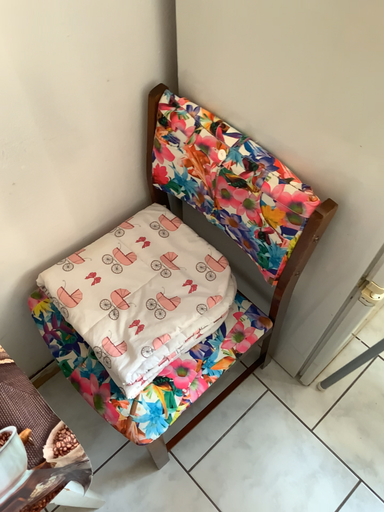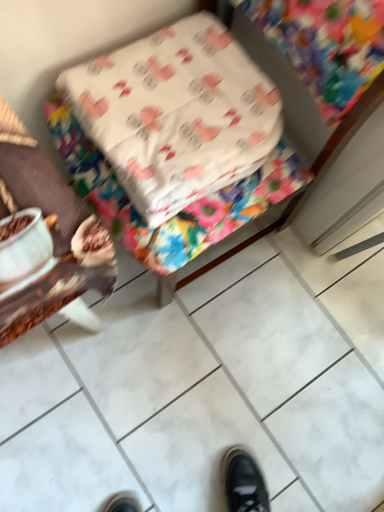
Question: How did the camera likely rotate when shooting the video?

Choices:
 (A) rotated downward
 (B) rotated upward

Answer: (A)